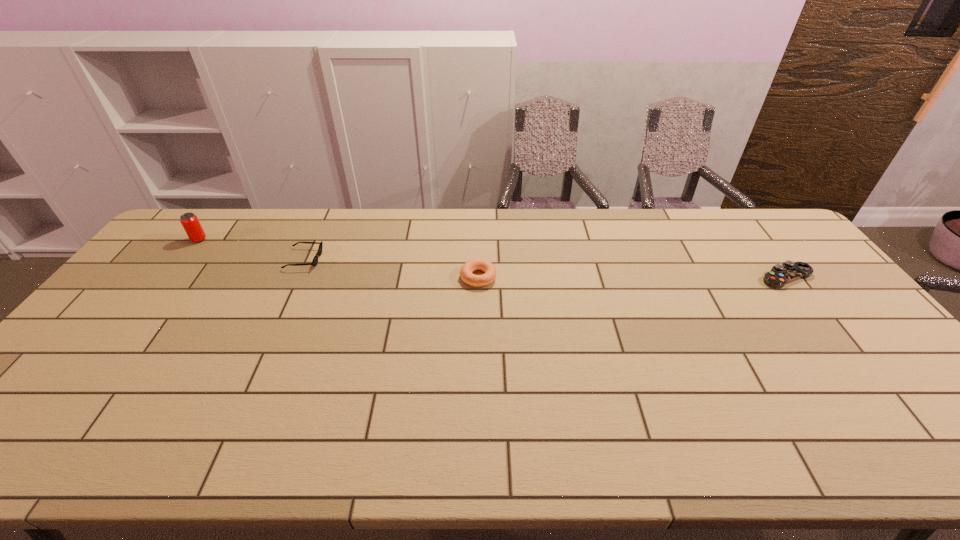
Locate which object is the second closest to the control. Please provide its 2D coordinates. Your answer should be formatted as a tuple, i.e. [(x, y)], where the tuple contains the x and y coordinates of a point satisfying the conditions above.

[(315, 260)]

Where is `object identified as the third closest to the shortest object`? This screenshot has width=960, height=540. object identified as the third closest to the shortest object is located at coordinates (779, 275).

Identify the location of free space that satisfies the following two spatial constraints: 1. on the front side of the can; 2. on the left side of the third object from left to right. (170, 277).

The width and height of the screenshot is (960, 540). I want to click on free space that satisfies the following two spatial constraints: 1. on the front-facing side of the bagel; 2. on the right side of the sunglasses, so click(x=296, y=277).

Find the location of a particular element. The image size is (960, 540). vacant space that satisfies the following two spatial constraints: 1. on the front-facing side of the shortest object; 2. on the left side of the control is located at coordinates (295, 278).

I want to click on vacant area that satisfies the following two spatial constraints: 1. on the front side of the rightmost object; 2. on the left side of the tallest object, so click(170, 278).

Find the location of `free point that satisfies the following two spatial constraints: 1. on the back side of the bagel; 2. on the front-facing side of the sunglasses`. free point that satisfies the following two spatial constraints: 1. on the back side of the bagel; 2. on the front-facing side of the sunglasses is located at coordinates (478, 259).

The image size is (960, 540). I want to click on vacant space that satisfies the following two spatial constraints: 1. on the front side of the control; 2. on the right side of the bagel, so click(478, 278).

This screenshot has height=540, width=960. I want to click on free space that satisfies the following two spatial constraints: 1. on the front-facing side of the rightmost object; 2. on the right side of the sunglasses, so click(295, 278).

Where is `vacant space that satisfies the following two spatial constraints: 1. on the front-facing side of the third object from right to left; 2. on the back side of the bagel`? This screenshot has height=540, width=960. vacant space that satisfies the following two spatial constraints: 1. on the front-facing side of the third object from right to left; 2. on the back side of the bagel is located at coordinates (296, 277).